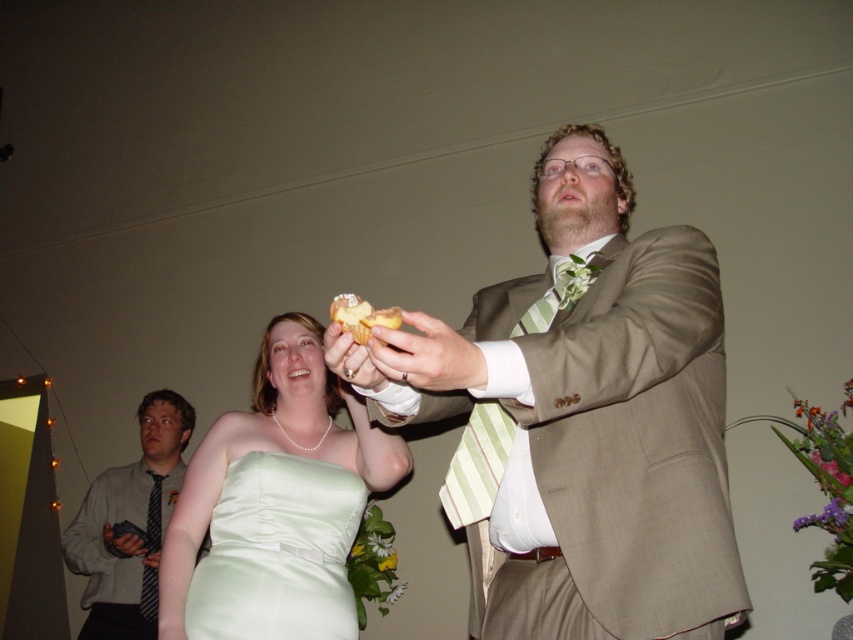
Looking at this image, between satin green dress at center and dark gray striped tie at left, which one appears on the left side from the viewer's perspective?

From the viewer's perspective, dark gray striped tie at left appears more on the left side.

Is satin green dress at center positioned in front of dark gray striped tie at left?

Yes.

Between point (315, 528) and point (143, 612), which one is positioned behind?

Positioned behind is point (143, 612).

The height and width of the screenshot is (640, 853). In order to click on satin green dress at center in this screenshot , I will do `click(276, 502)`.

Between point (231, 461) and point (343, 308), which one is positioned behind?

Positioned behind is point (231, 461).

Does satin dress at center have a lesser width compared to yellow sponge cake at center?

No, satin dress at center is not thinner than yellow sponge cake at center.

Identify the location of satin dress at center. The width and height of the screenshot is (853, 640). (277, 552).

Does satin green dress at center appear on the left side of satin dress at center?

Indeed, satin green dress at center is positioned on the left side of satin dress at center.

Looking at this image, does satin green dress at center lie behind satin dress at center?

No.

Identify the location of satin green dress at center. (276, 502).